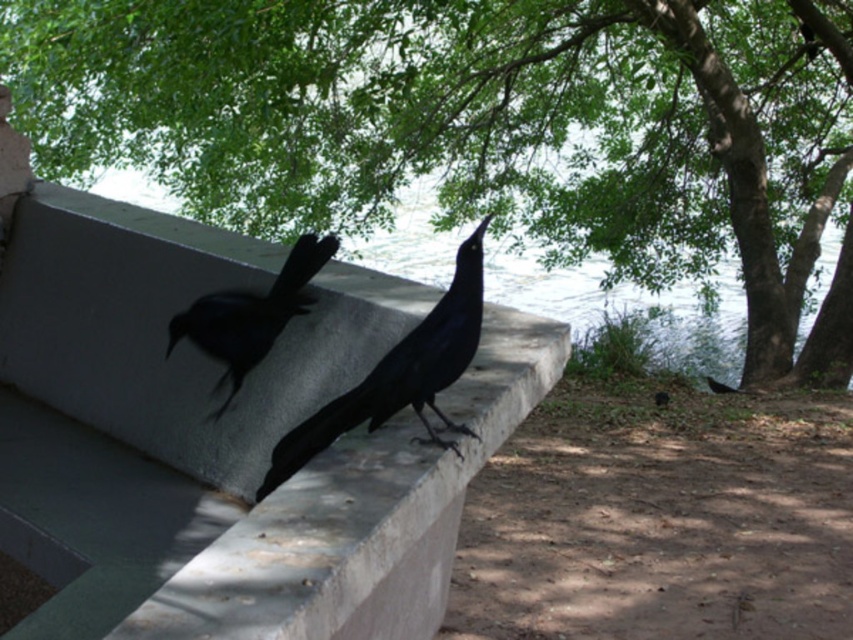
You are standing in front of the serene outdoor scene. You notice the smooth concrete ledge at center and the shiny black bird at center. Which object is positioned closer to you?

The smooth concrete ledge at center is closer to the viewer than the shiny black bird at center.

You are a bird watcher observing the scene. You notice the green leafy tree at upper center and the shiny black crow at center. Which object is positioned higher in the image?

The green leafy tree at upper center is positioned higher than the shiny black crow at center.